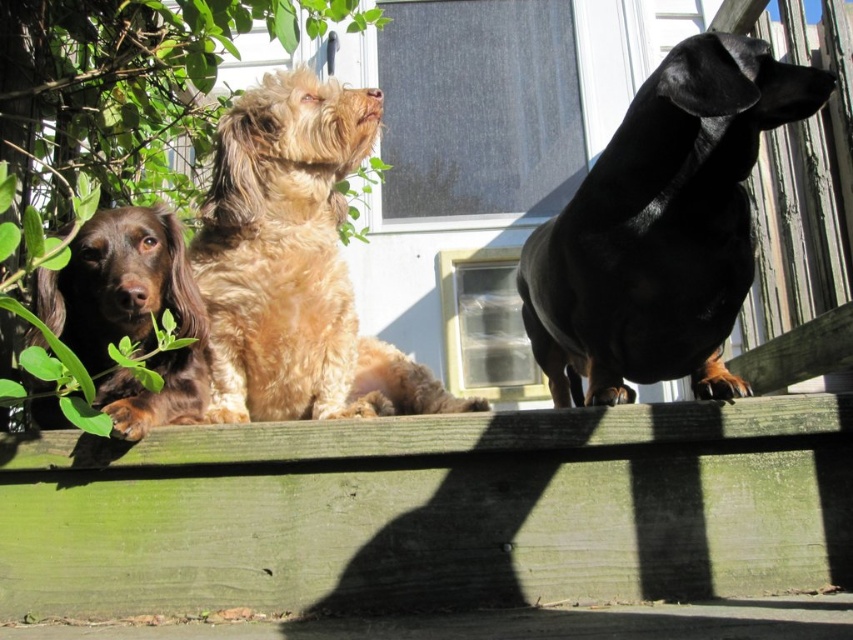
You are a photographer trying to position a small toy between the fuzzy brown dog at center and the brown furry dog at left so that both can see it easily. Based on their heights, where should you place the toy?

The fuzzy brown dog at center is much taller than the brown furry dog at left, so to ensure both can see the toy easily, place it at the height of the shorter brown furry dog at left.

You are a photographer trying to capture a photo of the fuzzy brown dog at center and the brown furry dog at left. Which dog should you focus on first if you want to ensure both are in focus without adjusting your camera settings?

You should focus on the brown furry dog at left first because it is closer to you than the fuzzy brown dog at center, which is further away. By focusing on the closer dog, the farther one will also be in focus due to depth of field.